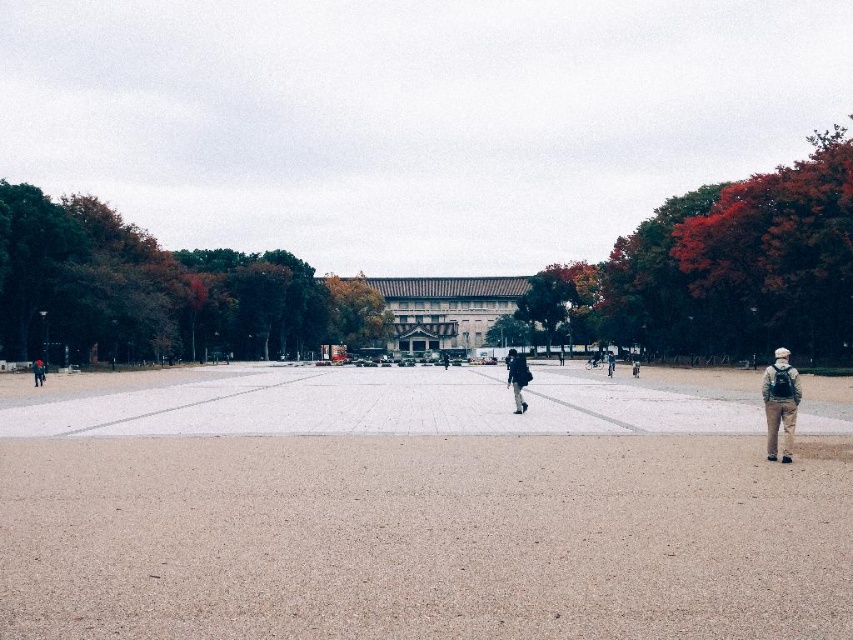
You are standing at the entrance of the plaza and see a person wearing a dark gray fabric jacket at center and khaki pants at center. Which piece of clothing is nearer to you?

The dark gray fabric jacket at center is closer to the viewer than the khaki pants at center.

You are standing at the entrance of the plaza and see two people wearing khaki pants at lower right and khaki pants at center. Which person is closer to you?

The khaki pants at lower right is in front of khaki pants at center, so the person wearing khaki pants at lower right is closer to you.